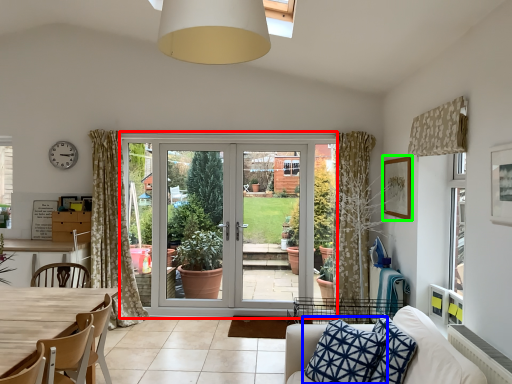
Question: Based on their relative distances, which object is farther from screen door (highlighted by a red box)? Choose from pillow (highlighted by a blue box) and picture frame (highlighted by a green box).

Choices:
 (A) pillow
 (B) picture frame

Answer: (A)